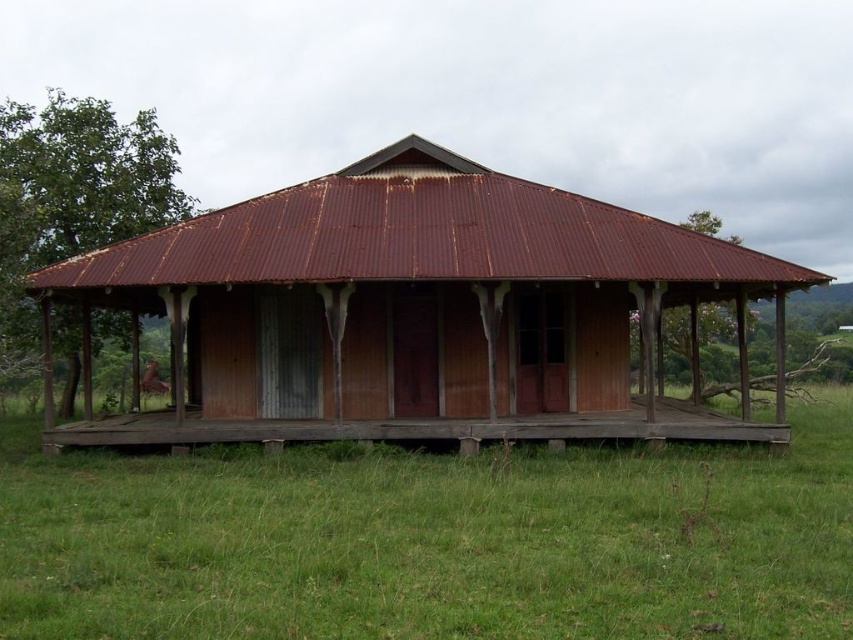
Question: Where is rusty wood hut at center located in relation to rusty wood porch at center in the image?

Choices:
 (A) right
 (B) left

Answer: (B)

Question: Can you confirm if rusty wood hut at center is bigger than rusty wood porch at center?

Choices:
 (A) no
 (B) yes

Answer: (B)

Question: Is rusty wood hut at center in front of rusty wood porch at center?

Choices:
 (A) no
 (B) yes

Answer: (B)

Question: Which object is farther from the camera taking this photo?

Choices:
 (A) rusty wood porch at center
 (B) rusty wood hut at center

Answer: (A)

Question: Which object is farther from the camera taking this photo?

Choices:
 (A) rusty wood hut at center
 (B) rusty wood porch at center

Answer: (B)